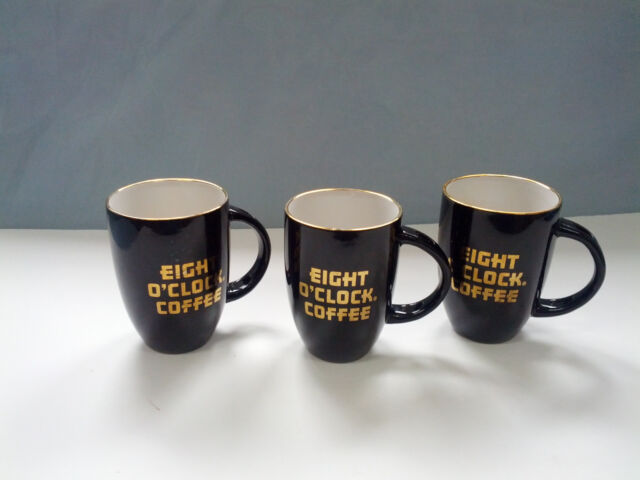
The image size is (640, 480). What are the coordinates of `mug` in the screenshot? It's located at (157, 235), (355, 243), (492, 229).